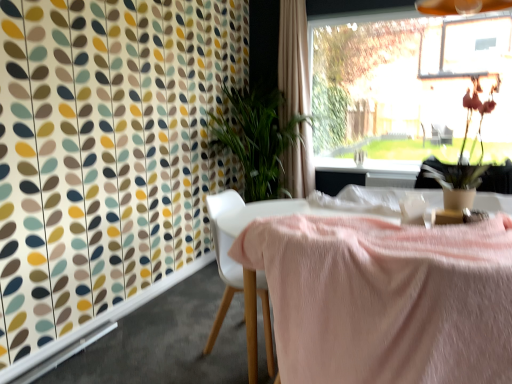
Question: Could you tell me if beige fabric curtain at upper center is facing transparent glass window at upper right?

Choices:
 (A) no
 (B) yes

Answer: (A)

Question: Does beige fabric curtain at upper center appear on the left side of transparent glass window at upper right?

Choices:
 (A) yes
 (B) no

Answer: (A)

Question: Considering the relative sizes of beige fabric curtain at upper center and transparent glass window at upper right in the image provided, is beige fabric curtain at upper center thinner than transparent glass window at upper right?

Choices:
 (A) yes
 (B) no

Answer: (B)

Question: Is beige fabric curtain at upper center beside transparent glass window at upper right?

Choices:
 (A) no
 (B) yes

Answer: (A)

Question: From the image's perspective, is beige fabric curtain at upper center located above transparent glass window at upper right?

Choices:
 (A) yes
 (B) no

Answer: (B)

Question: Is beige fabric curtain at upper center facing away from transparent glass window at upper right?

Choices:
 (A) no
 (B) yes

Answer: (B)

Question: Is white plastic chair at center wider than beige fabric curtain at upper center?

Choices:
 (A) yes
 (B) no

Answer: (A)

Question: From the image's perspective, is white plastic chair at center over beige fabric curtain at upper center?

Choices:
 (A) yes
 (B) no

Answer: (B)

Question: Is white plastic chair at center outside beige fabric curtain at upper center?

Choices:
 (A) yes
 (B) no

Answer: (A)

Question: Is white plastic chair at center thinner than beige fabric curtain at upper center?

Choices:
 (A) yes
 (B) no

Answer: (B)

Question: Could you tell me if white plastic chair at center is facing beige fabric curtain at upper center?

Choices:
 (A) yes
 (B) no

Answer: (B)

Question: Does white plastic chair at center appear on the right side of beige fabric curtain at upper center?

Choices:
 (A) no
 (B) yes

Answer: (A)

Question: Considering the relative sizes of beige fabric curtain at upper center and white plastic chair at center in the image provided, is beige fabric curtain at upper center smaller than white plastic chair at center?

Choices:
 (A) no
 (B) yes

Answer: (A)